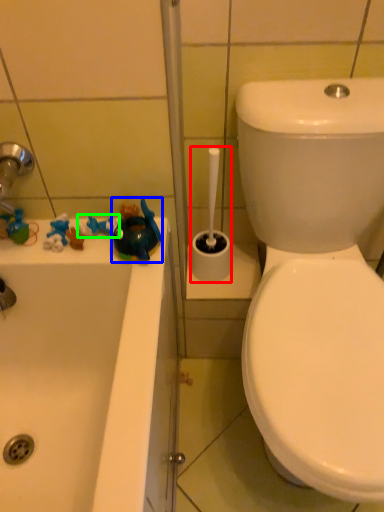
Question: Estimate the real-world distances between objects in this image. Which object is farther from shower (highlighted by a red box), toy (highlighted by a blue box) or toy (highlighted by a green box)?

Choices:
 (A) toy
 (B) toy

Answer: (B)